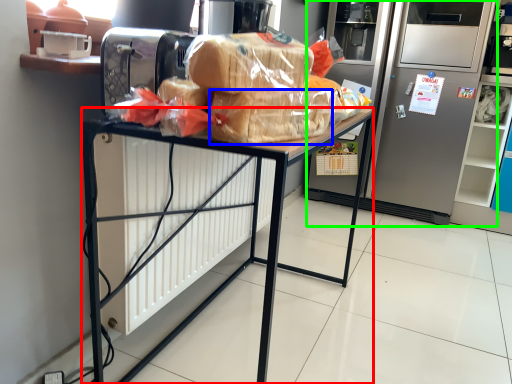
Question: Which object is positioned farthest from desk (highlighted by a red box)? Select from snack (highlighted by a blue box) and refrigerator (highlighted by a green box).

Choices:
 (A) snack
 (B) refrigerator

Answer: (B)